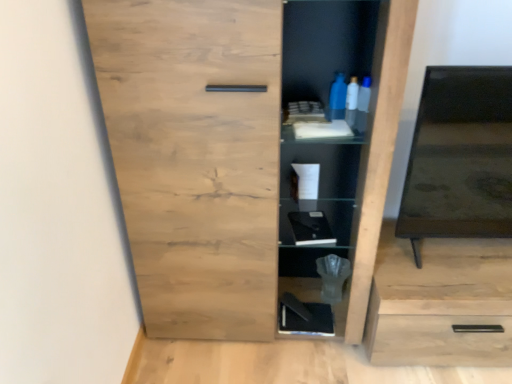
Question: Does black glossy tv at right have a larger size compared to natural wood cupboard at center?

Choices:
 (A) no
 (B) yes

Answer: (A)

Question: Is black glossy tv at right aimed at natural wood cupboard at center?

Choices:
 (A) no
 (B) yes

Answer: (A)

Question: From the image's perspective, would you say black glossy tv at right is positioned over natural wood cupboard at center?

Choices:
 (A) yes
 (B) no

Answer: (A)

Question: Would you say natural wood cupboard at center is part of black glossy tv at right's contents?

Choices:
 (A) no
 (B) yes

Answer: (A)

Question: Does black glossy tv at right touch natural wood cupboard at center?

Choices:
 (A) yes
 (B) no

Answer: (B)

Question: Looking at the image, does natural wood cupboard at center seem bigger or smaller compared to black glossy tv at right?

Choices:
 (A) big
 (B) small

Answer: (A)

Question: From a real-world perspective, is natural wood cupboard at center positioned above or below black glossy tv at right?

Choices:
 (A) below
 (B) above

Answer: (A)

Question: Considering the positions of natural wood cupboard at center and black glossy tv at right in the image, is natural wood cupboard at center wider or thinner than black glossy tv at right?

Choices:
 (A) thin
 (B) wide

Answer: (B)

Question: Choose the correct answer: Is natural wood cupboard at center inside black glossy tv at right or outside it?

Choices:
 (A) inside
 (B) outside

Answer: (B)

Question: Considering their positions, is black matte book at lower center, which ranks as the first cabinet in back-to-front order, located in front of or behind natural wood cupboard at center?

Choices:
 (A) front
 (B) behind

Answer: (B)

Question: Looking at their shapes, would you say black matte book at lower center, the second cabinet when ordered from front to back, is wider or thinner than natural wood cupboard at center?

Choices:
 (A) thin
 (B) wide

Answer: (A)

Question: From a real-world perspective, is black matte book at lower center, acting as the 2th cabinet starting from the top, above or below natural wood cupboard at center?

Choices:
 (A) below
 (B) above

Answer: (A)

Question: In the image, is black matte book at lower center, arranged as the 1th cabinet when ordered from the bottom, on the left side or the right side of natural wood cupboard at center?

Choices:
 (A) left
 (B) right

Answer: (B)

Question: Is point (330, 304) closer or farther from the camera than point (391, 332)?

Choices:
 (A) closer
 (B) farther

Answer: (B)

Question: Looking at the image, does black matte book at lower center, acting as the 2th cabinet starting from the top, seem bigger or smaller compared to light wood drawer at lower right?

Choices:
 (A) small
 (B) big

Answer: (A)